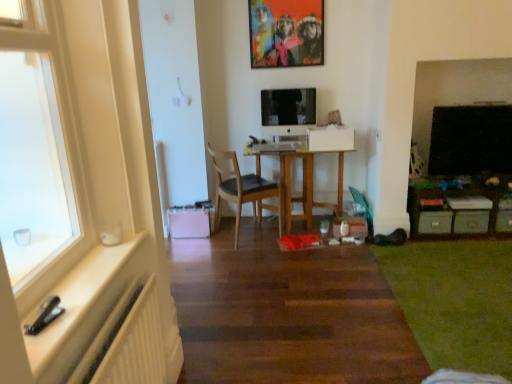
Question: Could you tell me if white ribbed radiator at lower left is facing black glossy tv at right?

Choices:
 (A) no
 (B) yes

Answer: (A)

Question: Is white ribbed radiator at lower left not within black glossy tv at right?

Choices:
 (A) yes
 (B) no

Answer: (A)

Question: Is white ribbed radiator at lower left at the right side of black glossy tv at right?

Choices:
 (A) no
 (B) yes

Answer: (A)

Question: Is white ribbed radiator at lower left taller than black glossy tv at right?

Choices:
 (A) yes
 (B) no

Answer: (B)

Question: Considering the relative sizes of white ribbed radiator at lower left and black glossy tv at right in the image provided, is white ribbed radiator at lower left bigger than black glossy tv at right?

Choices:
 (A) yes
 (B) no

Answer: (A)

Question: Is wooden desk at center bigger or smaller than green carpet at lower right?

Choices:
 (A) small
 (B) big

Answer: (B)

Question: In terms of height, does wooden desk at center look taller or shorter compared to green carpet at lower right?

Choices:
 (A) short
 (B) tall

Answer: (B)

Question: From a real-world perspective, is wooden desk at center positioned above or below green carpet at lower right?

Choices:
 (A) above
 (B) below

Answer: (A)

Question: In the image, is wooden desk at center on the left side or the right side of green carpet at lower right?

Choices:
 (A) left
 (B) right

Answer: (A)

Question: In the image, is wooden desk at center positioned in front of or behind wooden chair at center?

Choices:
 (A) behind
 (B) front

Answer: (A)

Question: In terms of size, does wooden desk at center appear bigger or smaller than wooden chair at center?

Choices:
 (A) big
 (B) small

Answer: (A)

Question: Which is correct: wooden desk at center is inside wooden chair at center, or outside of it?

Choices:
 (A) inside
 (B) outside

Answer: (B)

Question: In terms of width, does wooden desk at center look wider or thinner when compared to wooden chair at center?

Choices:
 (A) thin
 (B) wide

Answer: (B)

Question: Looking at the image, does white glossy window sill at left seem bigger or smaller compared to green carpet at lower right?

Choices:
 (A) small
 (B) big

Answer: (B)

Question: From a real-world perspective, is white glossy window sill at left physically located above or below green carpet at lower right?

Choices:
 (A) below
 (B) above

Answer: (B)